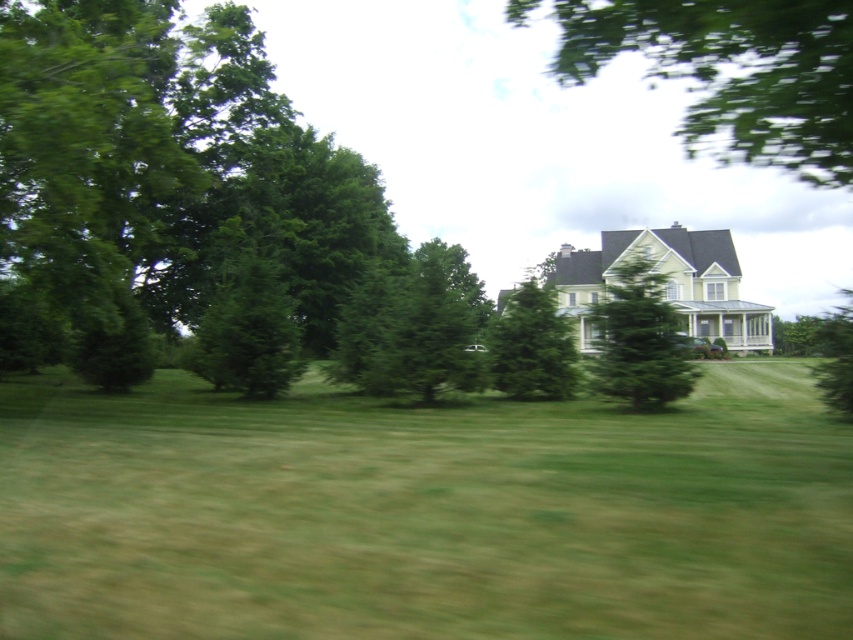
You are a landscape architect designing a garden path between the green textured tree at center and the green textured evergreen tree at center. Which tree should you place closer to the entrance of the house to ensure the path doesn t feel too cramped?

The green textured evergreen tree at center should be placed closer to the entrance since it is smaller in size compared to the green textured tree at center, allowing for a more spacious path design.

A drone is flying above the suburban house and wants to take a photo of the green leafy tree at upper center. According to the coordinates provided, where should the drone focus its camera to capture the tree?

The drone should focus its camera at point [735,74] to capture the green leafy tree at upper center.